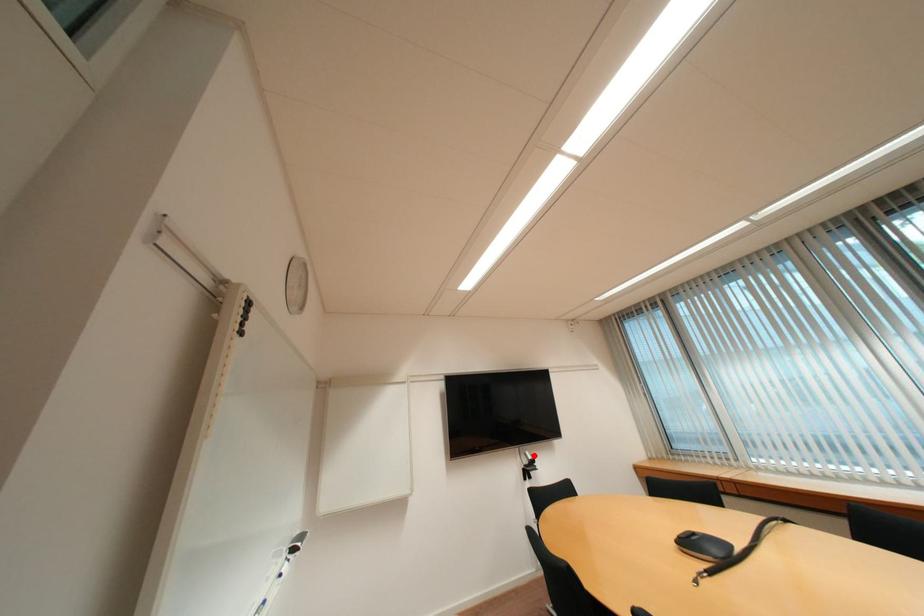
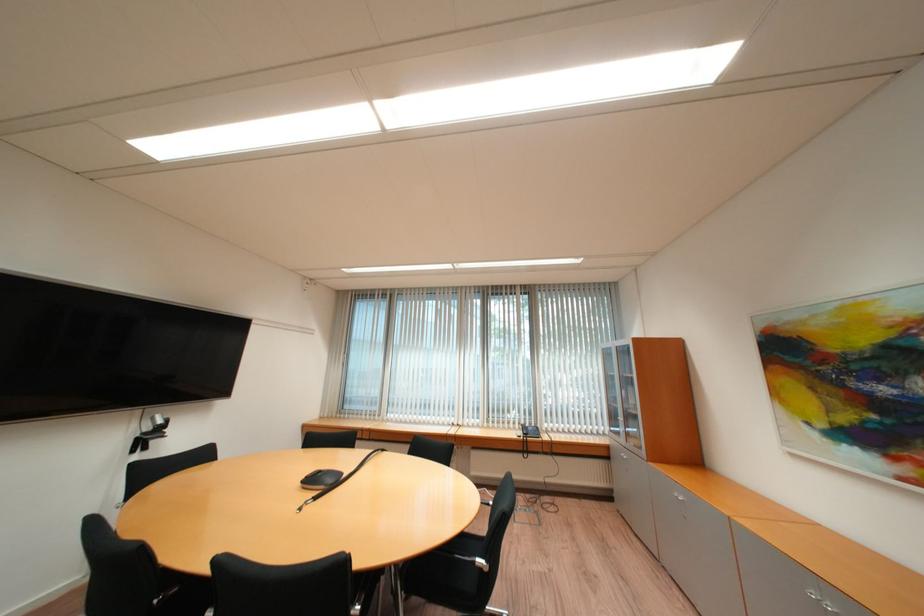
Where in the second image is the point corresponding to the highlighted location from the first image?

(162, 419)